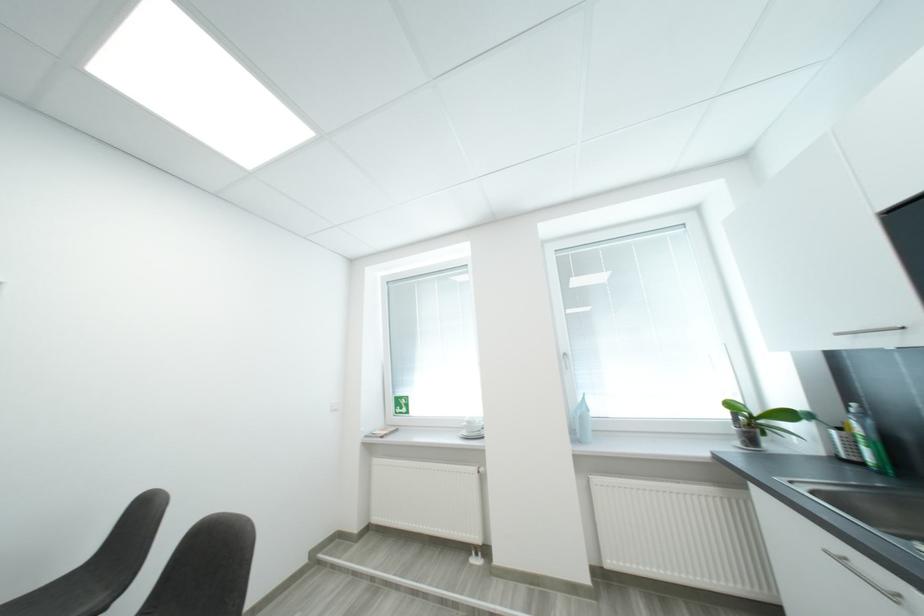
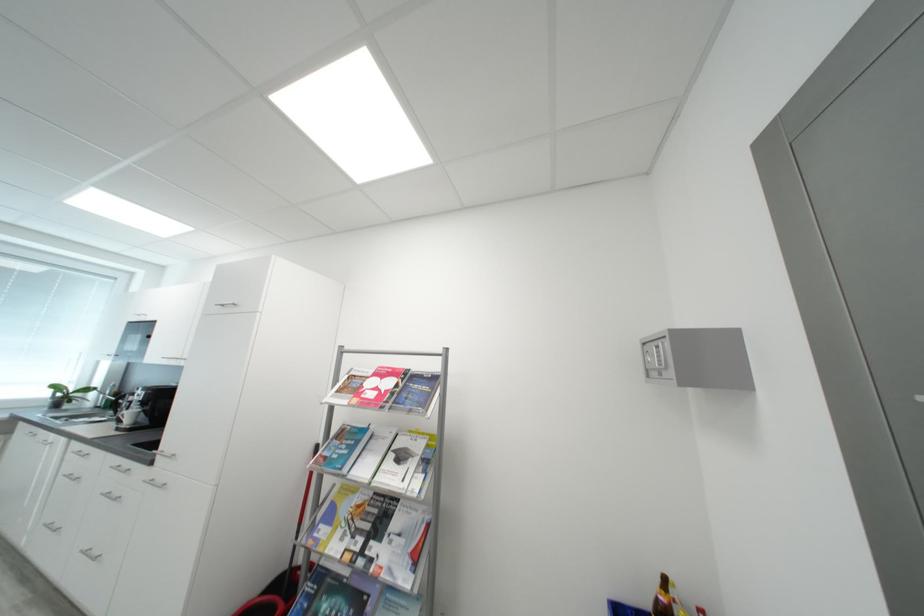
Where in the second image is the point corresponding to [736,407] from the first image?

(62, 389)